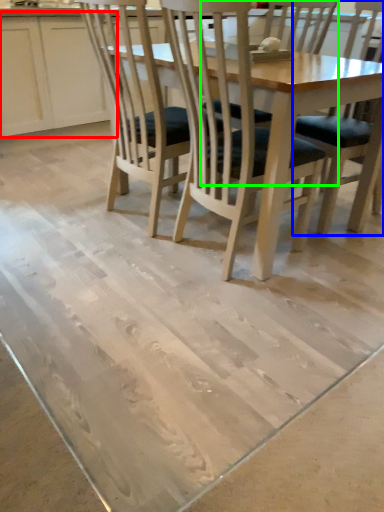
Question: Considering the real-world distances, which object is farthest from cabinetry (highlighted by a red box)? chair (highlighted by a blue box) or chair (highlighted by a green box)?

Choices:
 (A) chair
 (B) chair

Answer: (A)